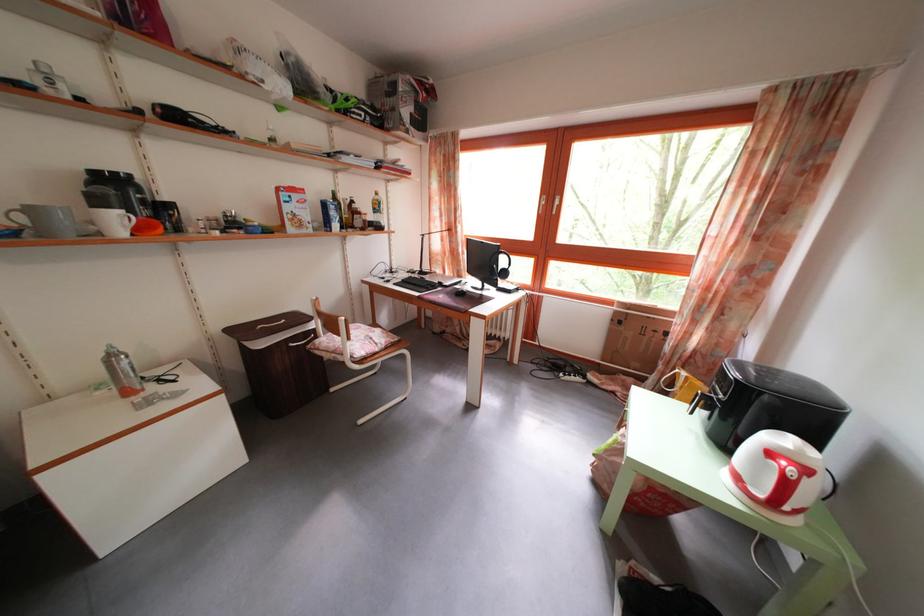
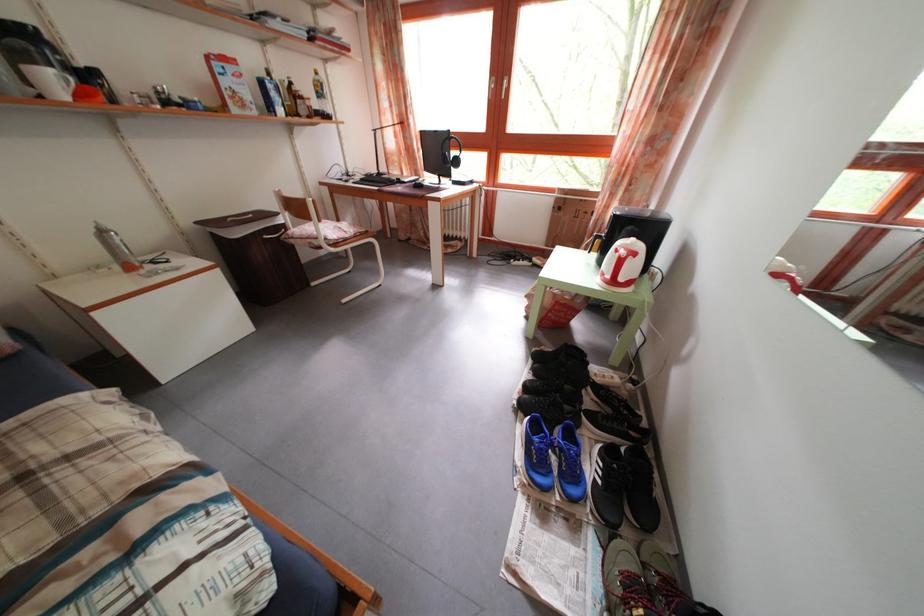
Find the pixel in the second image that matches point 812,477 in the first image.

(641, 262)